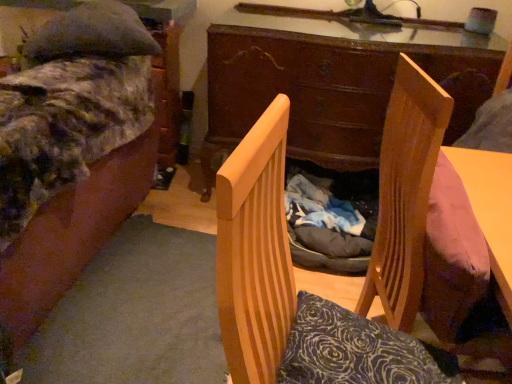
Where is `velvet-like fabric bed at left`? velvet-like fabric bed at left is located at coordinates (70, 154).

Locate an element on the screen. This screenshot has width=512, height=384. wooden desk at center is located at coordinates (330, 87).

At what (x,y) coordinates should I click in order to perform the action: click on velvet-like fabric bed at left. Please return your answer as a coordinate pair (x, y). Looking at the image, I should click on (70, 154).

Which object is wider, wooden chair at center or wooden desk at center?

wooden desk at center.

Is wooden chair at center outside of wooden desk at center?

That's correct, wooden chair at center is outside of wooden desk at center.

Considering the relative positions of wooden chair at center and wooden desk at center in the image provided, is wooden chair at center to the left or to the right of wooden desk at center?

Based on their positions, wooden chair at center is located to the left of wooden desk at center.

In the scene shown: Is wooden chair at center taller than wooden desk at center?

Incorrect, the height of wooden chair at center is not larger of that of wooden desk at center.

From the image's perspective, is wooden desk at center positioned above or below velvet-like fabric bed at left?

wooden desk at center is above velvet-like fabric bed at left.

Is wooden desk at center wider or thinner than velvet-like fabric bed at left?

Considering their sizes, wooden desk at center looks slimmer than velvet-like fabric bed at left.

In the image, is wooden desk at center positioned in front of or behind velvet-like fabric bed at left?

Visually, wooden desk at center is located behind velvet-like fabric bed at left.

Identify the location of desk behind the velvet-like fabric bed at left. (330, 87).

Which object is positioned more to the right, velvet-like fabric bed at left or wooden desk at center?

Positioned to the right is wooden desk at center.

Is velvet-like fabric bed at left next to wooden desk at center and touching it?

velvet-like fabric bed at left and wooden desk at center are clearly separated.

Is velvet-like fabric bed at left far away from wooden chair at center?

They are positioned close to each other.

Who is more distant, velvet-like fabric bed at left or wooden chair at center?

velvet-like fabric bed at left is further from the camera.

Could you tell me if velvet-like fabric bed at left is facing wooden chair at center?

No, velvet-like fabric bed at left is not facing towards wooden chair at center.

Looking at this image, from a real-world perspective, is velvet-like fabric bed at left below wooden chair at center?

Yes.

Is wooden chair at center turned away from velvet-like fabric bed at left?

Absolutely, wooden chair at center is directed away from velvet-like fabric bed at left.

From the image's perspective, which object appears higher, wooden chair at center or velvet-like fabric bed at left?

velvet-like fabric bed at left appears higher in the image.

Which object is wider, wooden chair at center or velvet-like fabric bed at left?

With larger width is velvet-like fabric bed at left.

Relative to velvet-like fabric bed at left, is wooden chair at center in front or behind?

A: wooden chair at center is in front of velvet-like fabric bed at left.

Looking at this image, is wooden desk at center facing away from wooden chair at center?

wooden desk at center does not have its back to wooden chair at center.

Is wooden desk at center directly adjacent to wooden chair at center?

No, wooden desk at center is not beside wooden chair at center.

From the image's perspective, does wooden desk at center appear higher than wooden chair at center?

Yes, from the image's perspective, wooden desk at center is on top of wooden chair at center.

The image size is (512, 384). Find the location of `desk beneath the wooden chair at center (from a real-world perspective)`. desk beneath the wooden chair at center (from a real-world perspective) is located at coordinates (330, 87).

Image resolution: width=512 pixels, height=384 pixels. In order to click on desk on the right of velvet-like fabric bed at left in this screenshot , I will do pyautogui.click(x=330, y=87).

Based on their spatial positions, is wooden chair at center or velvet-like fabric bed at left further from wooden desk at center?

wooden chair at center.

Based on the photo, from the image, which object appears to be nearer to wooden chair at center, velvet-like fabric bed at left or wooden desk at center?

velvet-like fabric bed at left is positioned closer to the anchor wooden chair at center.

From the image, which object appears to be farther from wooden desk at center, velvet-like fabric bed at left or wooden chair at center?

The object further to wooden desk at center is wooden chair at center.

When comparing their distances from velvet-like fabric bed at left, does wooden desk at center or wooden chair at center seem closer?

wooden desk at center.

In the scene shown: Looking at the image, which one is located further to velvet-like fabric bed at left, wooden chair at center or wooden desk at center?

wooden chair at center is further to velvet-like fabric bed at left.

When comparing their distances from wooden chair at center, does wooden desk at center or velvet-like fabric bed at left seem further?

wooden desk at center is positioned further to the anchor wooden chair at center.

Where is `chair between velvet-like fabric bed at left and wooden desk at center in the horizontal direction`? The height and width of the screenshot is (384, 512). chair between velvet-like fabric bed at left and wooden desk at center in the horizontal direction is located at coordinates (290, 288).